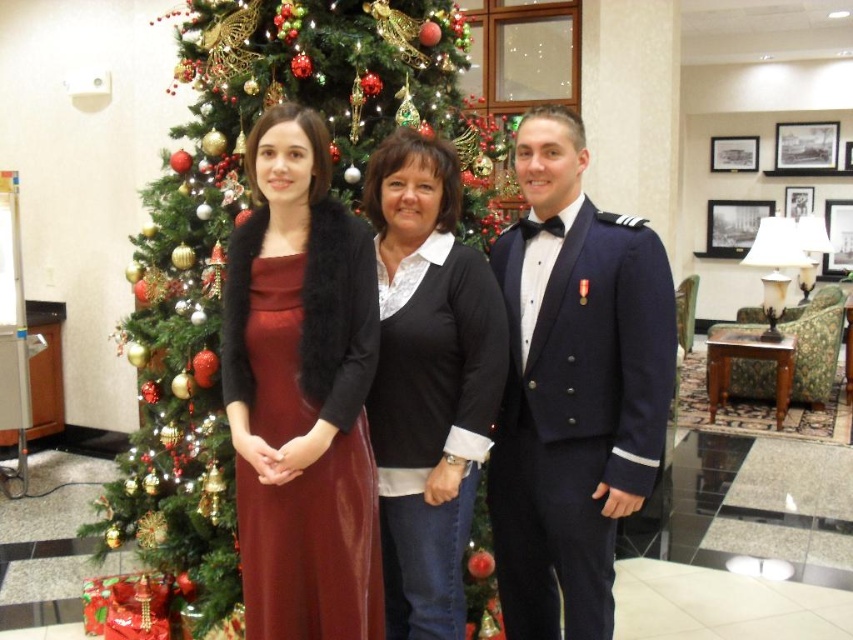
You are a photographer at this event. You want to take a photo of the matte black dress at center and the black sweater at center without any overlap between them. Given that your camera has a minimum focus distance of 4 inches, will you be able to capture both subjects clearly in the frame?

The distance between the matte black dress at center and the black sweater at center is 4.01 inches, which is just over the camera minimum focus distance of 4 inches. Therefore, you can capture both subjects clearly without overlap.

You are planning to take a photo of the navy blue uniform at center and the velvet burgundy dress at left. Which one should you focus on first if you want to capture both in the same frame without moving the camera?

The navy blue uniform at center is taller than the velvet burgundy dress at left, so you should focus on the navy blue uniform at center first to ensure both are in the frame.

You are a photographer at a Christmas party. You need to take a photo of the two women in the velvet burgundy dress at left and matte black dress at center. Can you see both of them clearly in the photo?

The velvet burgundy dress at left is behind the matte black dress at center, so the velvet burgundy dress at left may be partially obscured in the photo.